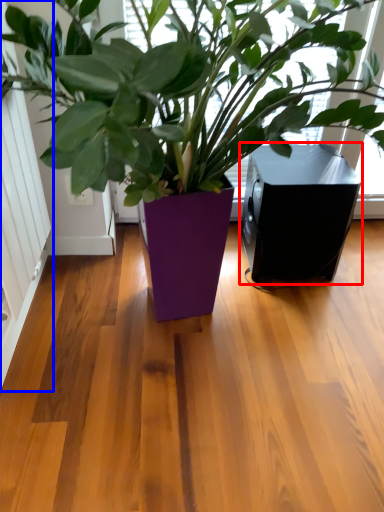
Question: Which object is closer to the camera taking this photo, speaker (highlighted by a red box) or screen door (highlighted by a blue box)?

Choices:
 (A) speaker
 (B) screen door

Answer: (B)